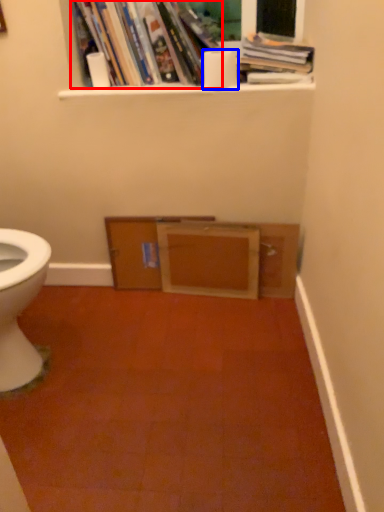
Question: Which of the following is the farthest to the observer, book (highlighted by a red box) or toilet paper (highlighted by a blue box)?

Choices:
 (A) book
 (B) toilet paper

Answer: (B)